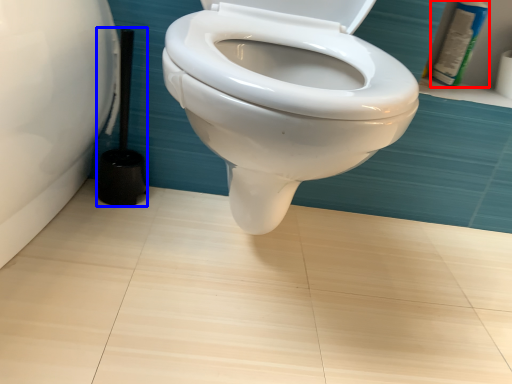
Question: Which point is further to the camera, toiletry (highlighted by a red box) or brush (highlighted by a blue box)?

Choices:
 (A) toiletry
 (B) brush

Answer: (A)